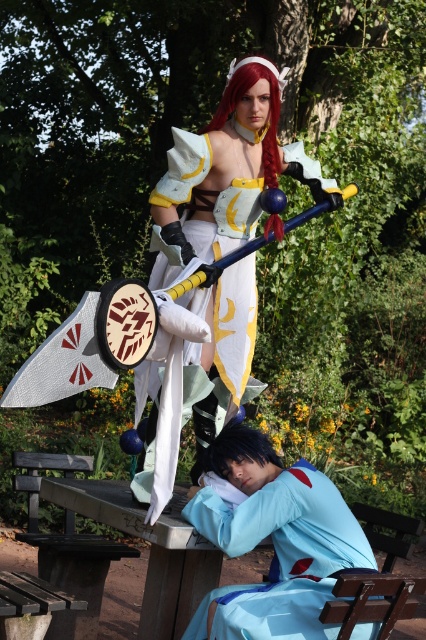
In the scene shown: Does white satin dress at center appear on the right side of light blue fabric at lower center?

In fact, white satin dress at center is to the left of light blue fabric at lower center.

Between point (242, 184) and point (235, 632), which one is positioned behind?

Point (242, 184)

Is point (218, 321) closer to viewer compared to point (250, 548)?

No.

Where is `white satin dress at center`? white satin dress at center is located at coordinates (227, 173).